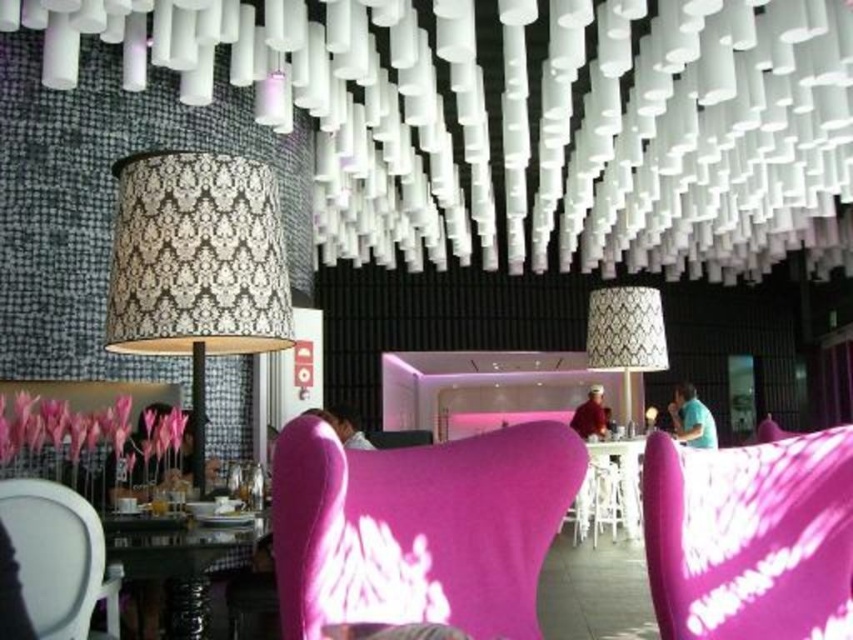
Question: Does pink fabric armchair at center appear on the right side of matte pink fabric armchair at center?

Choices:
 (A) yes
 (B) no

Answer: (B)

Question: Does matte pink fabric armchair at center have a smaller size compared to white fabric armchair at lower left?

Choices:
 (A) no
 (B) yes

Answer: (A)

Question: Which point is farther to the camera?

Choices:
 (A) (799, 452)
 (B) (59, 625)
 (C) (141, 298)
 (D) (172, 596)

Answer: (C)

Question: Which point is closer to the camera?

Choices:
 (A) (119, 545)
 (B) (630, 538)
 (C) (749, 445)

Answer: (C)

Question: Which point is closer to the camera?

Choices:
 (A) patterned fabric lampshade at center
 (B) pink fabric armchair at center
 (C) matte pink fabric armchair at center

Answer: (B)

Question: Is the position of white matte chandelier at upper center more distant than that of glassy black table at lower left?

Choices:
 (A) no
 (B) yes

Answer: (B)